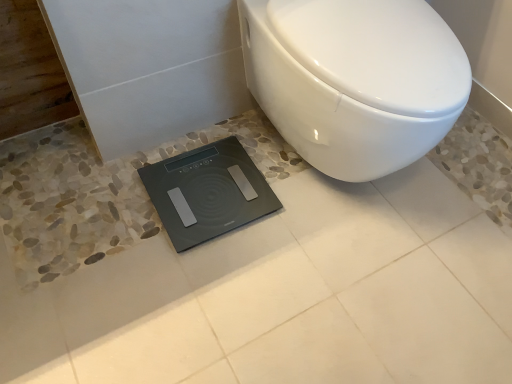
What are the coordinates of `free point below black glass scale at lower center (from a real-world perspective)` in the screenshot? It's located at (202, 196).